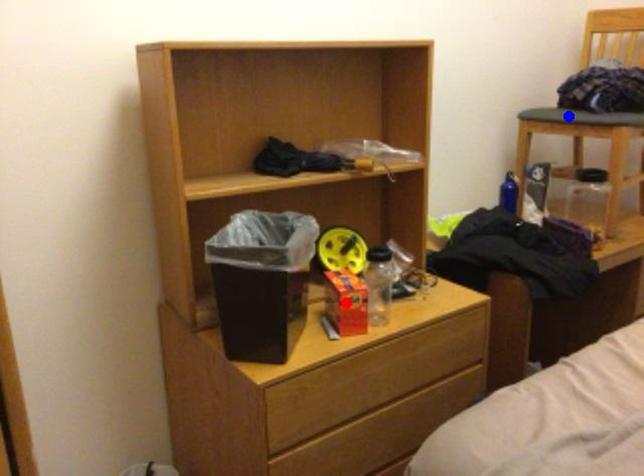
Question: Two points are marked on the image. Which point is closer to the camera?

Choices:
 (A) Blue point is closer.
 (B) Red point is closer.

Answer: (B)